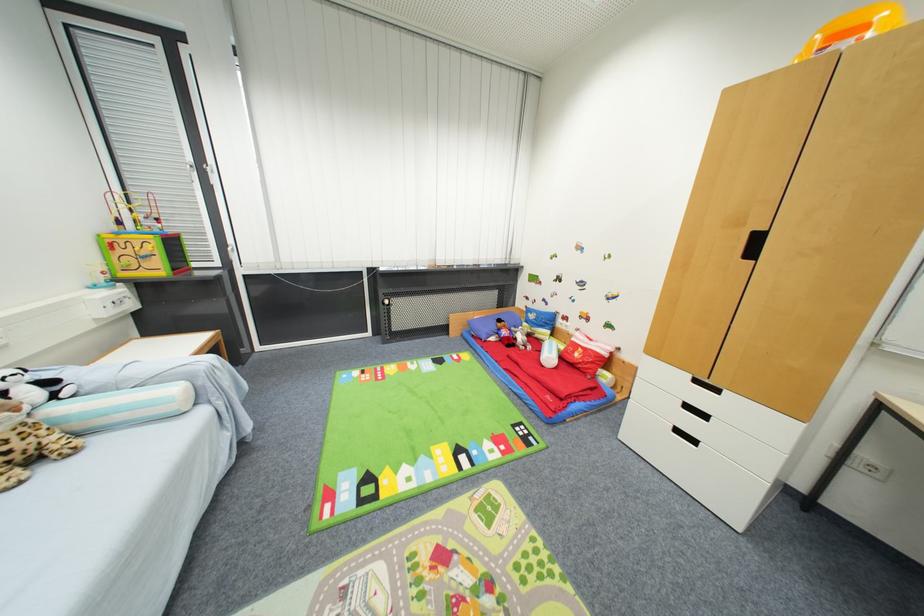
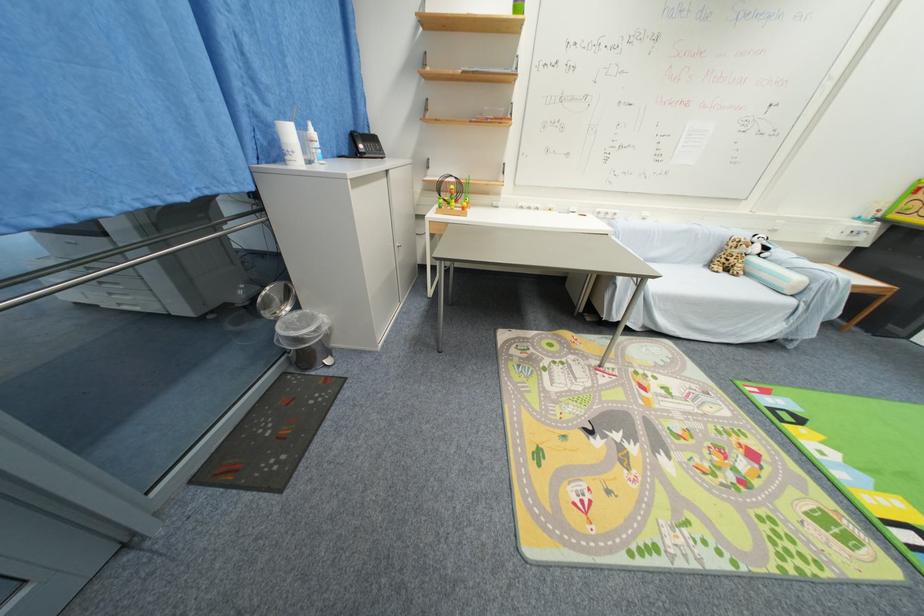
Find the pixel in the second image that matches (38,395) in the first image.

(761, 251)